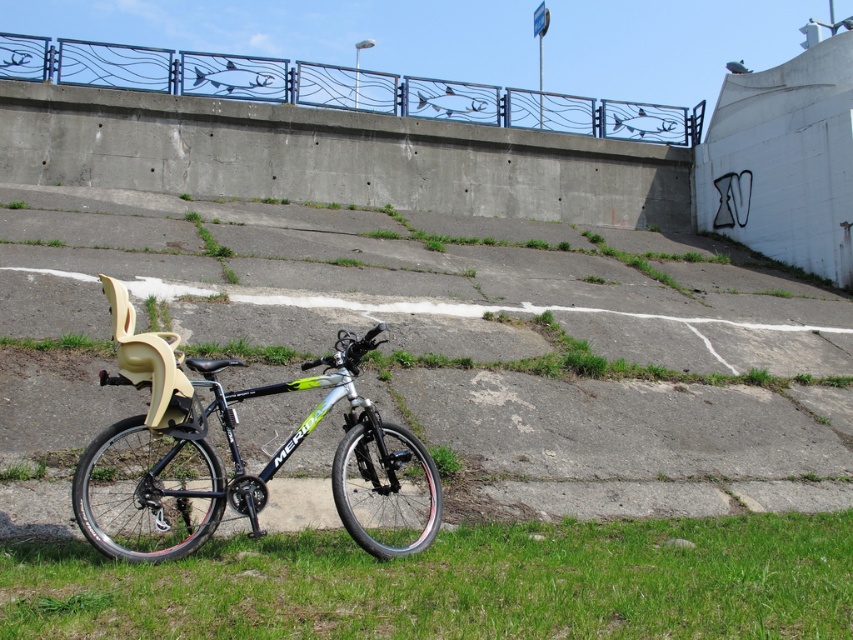
Question: Which of the following is the farthest from the observer?

Choices:
 (A) green grass at lower center
 (B) blue metal rail at upper center

Answer: (B)

Question: Considering the relative positions of silver metallic bicycle at center and blue metal rail at upper center in the image provided, where is silver metallic bicycle at center located with respect to blue metal rail at upper center?

Choices:
 (A) above
 (B) below

Answer: (B)

Question: Is silver metallic bicycle at center thinner than blue metal rail at upper center?

Choices:
 (A) yes
 (B) no

Answer: (A)

Question: Can you confirm if green grass at lower center is positioned above blue metal rail at upper center?

Choices:
 (A) yes
 (B) no

Answer: (B)

Question: Considering the real-world distances, which object is farthest from the green grass at lower center?

Choices:
 (A) silver metallic bicycle at center
 (B) blue metal rail at upper center

Answer: (B)

Question: Which point is closer to the camera?

Choices:
 (A) (270, 595)
 (B) (100, 445)
 (C) (334, 106)

Answer: (A)